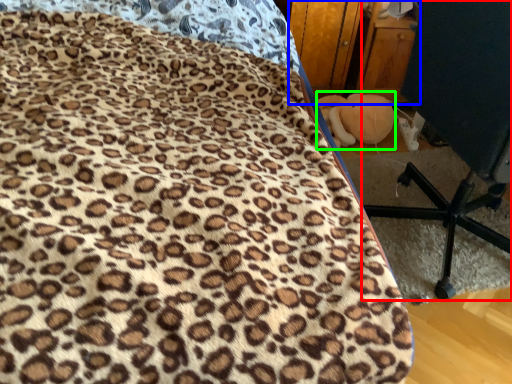
Question: Which is farther away from furniture (highlighted by a red box)? dresser (highlighted by a blue box) or toy (highlighted by a green box)?

Choices:
 (A) dresser
 (B) toy

Answer: (A)